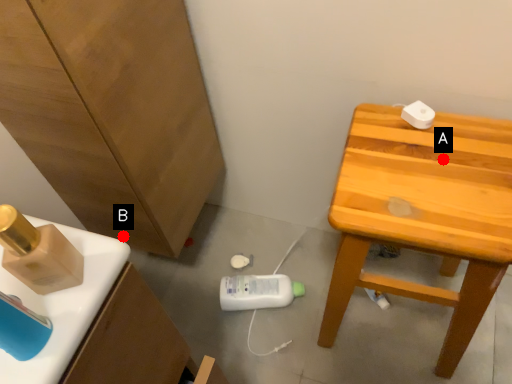
Question: Two points are circled on the image, labeled by A and B beside each circle. Which of the following is the closest to the observer?

Choices:
 (A) A is closer
 (B) B is closer

Answer: (A)